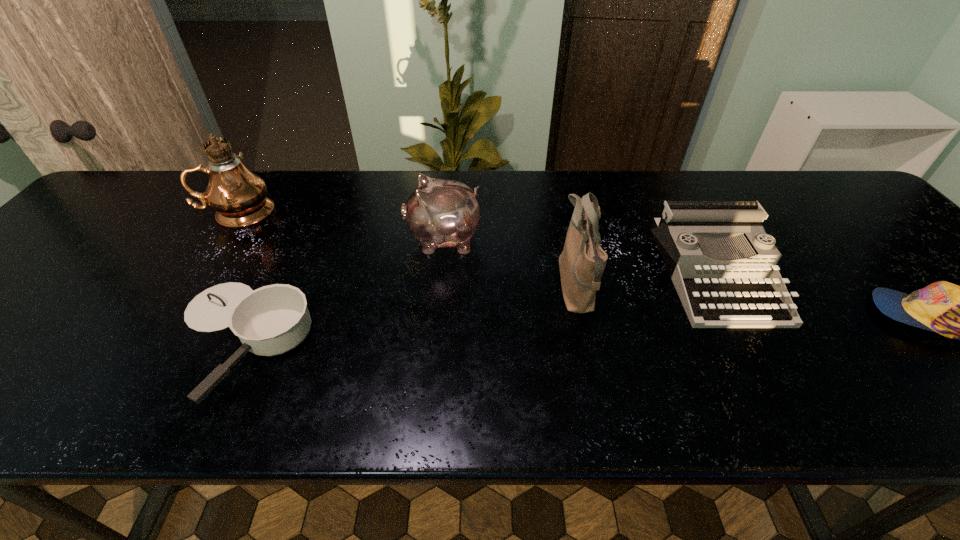
The height and width of the screenshot is (540, 960). I want to click on vacant position located 0.350m on the front-facing side of the fifth shortest object, so click(405, 287).

The width and height of the screenshot is (960, 540). Identify the location of blank space located on the front-facing side of the fifth shortest object. (492, 287).

The width and height of the screenshot is (960, 540). Find the location of `free space located 0.320m on the front facing side of the third object from left to right`. free space located 0.320m on the front facing side of the third object from left to right is located at coordinates (281, 239).

Where is `free space located 0.100m on the front facing side of the third object from left to right`? free space located 0.100m on the front facing side of the third object from left to right is located at coordinates (367, 239).

Identify the location of vacant space located on the front facing side of the third object from left to right. This screenshot has height=540, width=960. (351, 239).

This screenshot has width=960, height=540. In order to click on blank space located on the typing side of the fourth tallest object in this screenshot , I will do `click(788, 406)`.

The image size is (960, 540). Find the location of `vacant space located 0.280m on the left of the saucepan`. vacant space located 0.280m on the left of the saucepan is located at coordinates (32, 340).

I want to click on object situated at the far edge, so click(239, 196).

Locate an element on the screen. object at the near edge is located at coordinates (271, 320).

Locate an element on the screen. This screenshot has height=540, width=960. vacant space at the far edge of the desktop is located at coordinates (790, 207).